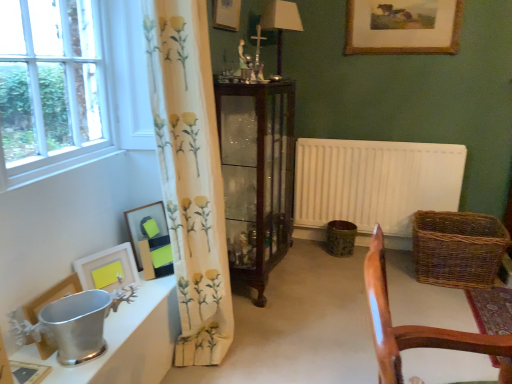
Question: Considering the relative sizes of white matte picture frame at lower left, the fourth picture frame in the back-to-front sequence, and wooden chair at lower right in the image provided, is white matte picture frame at lower left, the fourth picture frame in the back-to-front sequence, wider than wooden chair at lower right?

Choices:
 (A) no
 (B) yes

Answer: (A)

Question: Does white matte picture frame at lower left, the fourth picture frame in the back-to-front sequence, appear on the left side of wooden chair at lower right?

Choices:
 (A) no
 (B) yes

Answer: (B)

Question: Is white matte picture frame at lower left, the 4th picture frame in the right-to-left sequence, facing away from wooden chair at lower right?

Choices:
 (A) yes
 (B) no

Answer: (B)

Question: Would you consider white matte picture frame at lower left, the 4th picture frame in the right-to-left sequence, to be distant from wooden chair at lower right?

Choices:
 (A) no
 (B) yes

Answer: (B)

Question: Is white matte picture frame at lower left, the fourth picture frame in the back-to-front sequence, at the right side of wooden chair at lower right?

Choices:
 (A) no
 (B) yes

Answer: (A)

Question: In terms of width, does gold-framed painting at upper center, placed as the sixth picture frame when sorted from left to right, look wider or thinner when compared to white matte radiator at center right?

Choices:
 (A) wide
 (B) thin

Answer: (B)

Question: Visually, is gold-framed painting at upper center, which is the sixth picture frame from front to back, positioned to the left or to the right of white matte radiator at center right?

Choices:
 (A) right
 (B) left

Answer: (A)

Question: In terms of size, does gold-framed painting at upper center, which is counted as the first picture frame, starting from the top, appear bigger or smaller than white matte radiator at center right?

Choices:
 (A) small
 (B) big

Answer: (A)

Question: Do you think gold-framed painting at upper center, placed as the sixth picture frame when sorted from left to right, is within white matte radiator at center right, or outside of it?

Choices:
 (A) outside
 (B) inside

Answer: (A)

Question: Is point (118, 344) positioned closer to the camera than point (471, 339)?

Choices:
 (A) farther
 (B) closer

Answer: (A)

Question: From the image's perspective, is polished silver bucket at lower left located above or below wooden chair at lower right?

Choices:
 (A) below
 (B) above

Answer: (A)

Question: In terms of size, does polished silver bucket at lower left appear bigger or smaller than wooden chair at lower right?

Choices:
 (A) big
 (B) small

Answer: (B)

Question: Considering the positions of polished silver bucket at lower left and wooden chair at lower right in the image, is polished silver bucket at lower left wider or thinner than wooden chair at lower right?

Choices:
 (A) thin
 (B) wide

Answer: (A)

Question: Is gold-framed painting at upper center, placed as the sixth picture frame when sorted from left to right, wider or thinner than dark wood cabinet at center?

Choices:
 (A) wide
 (B) thin

Answer: (B)

Question: Based on their sizes in the image, would you say gold-framed painting at upper center, placed as the 1th picture frame when sorted from right to left, is bigger or smaller than dark wood cabinet at center?

Choices:
 (A) small
 (B) big

Answer: (A)